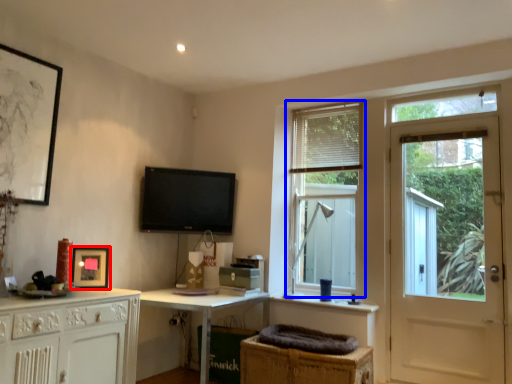
Question: Among these objects, which one is nearest to the camera, picture frame (highlighted by a red box) or window (highlighted by a blue box)?

Choices:
 (A) picture frame
 (B) window

Answer: (A)